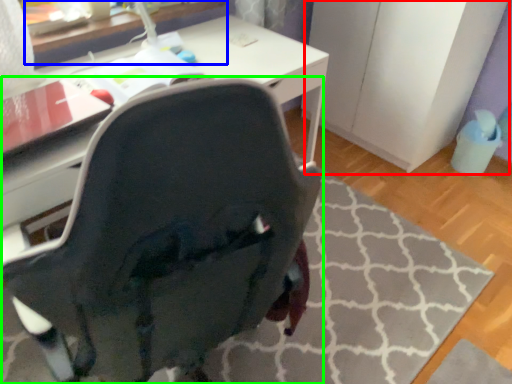
Question: Estimate the real-world distances between objects in this image. Which object is closer to file cabinet (highlighted by a red box), table (highlighted by a blue box) or chair (highlighted by a green box)?

Choices:
 (A) table
 (B) chair

Answer: (A)